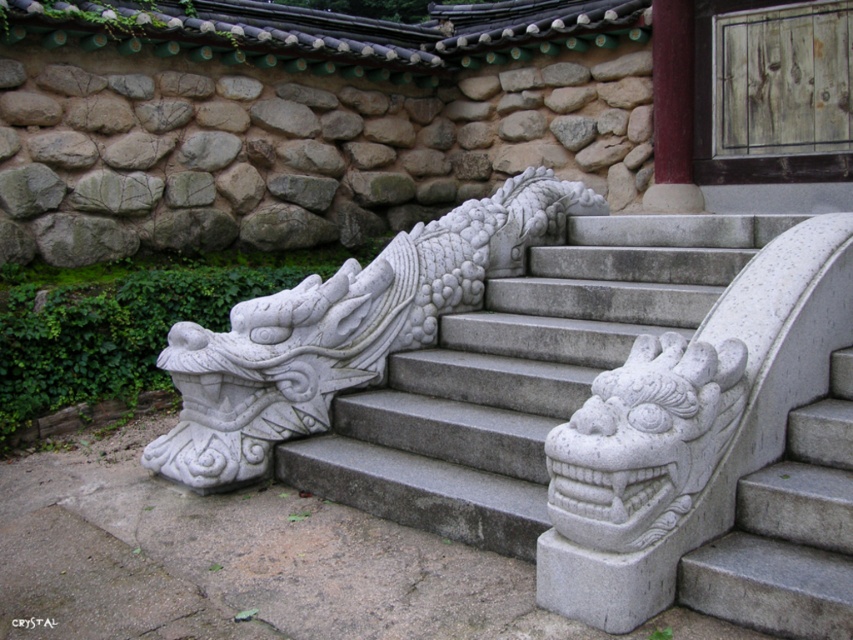
Can you confirm if gray stone stairs at center is wider than white stone dragon at lower left?

Yes.

Can you confirm if gray stone stairs at center is taller than white stone dragon at lower left?

In fact, gray stone stairs at center may be shorter than white stone dragon at lower left.

Which is in front, point (498, 364) or point (239, 330)?

Point (239, 330) is more forward.

The height and width of the screenshot is (640, 853). What are the coordinates of `gray stone stairs at center` in the screenshot? It's located at (604, 404).

Consider the image. Does white stone dragon head at upper right have a greater width compared to smooth red wood at upper right?

Yes.

Which of these two, white stone dragon head at upper right or smooth red wood at upper right, stands shorter?

white stone dragon head at upper right is shorter.

Between point (558, 476) and point (675, 42), which one is positioned behind?

The point (675, 42) is behind.

This screenshot has height=640, width=853. In order to click on white stone dragon head at upper right in this screenshot , I will do `click(643, 442)`.

Which of these two, white stone dragon at lower left or smooth red wood at upper right, stands taller?

white stone dragon at lower left

Is point (245, 378) farther from viewer compared to point (689, 108)?

No, (245, 378) is closer to viewer.

The image size is (853, 640). I want to click on white stone dragon at lower left, so click(341, 330).